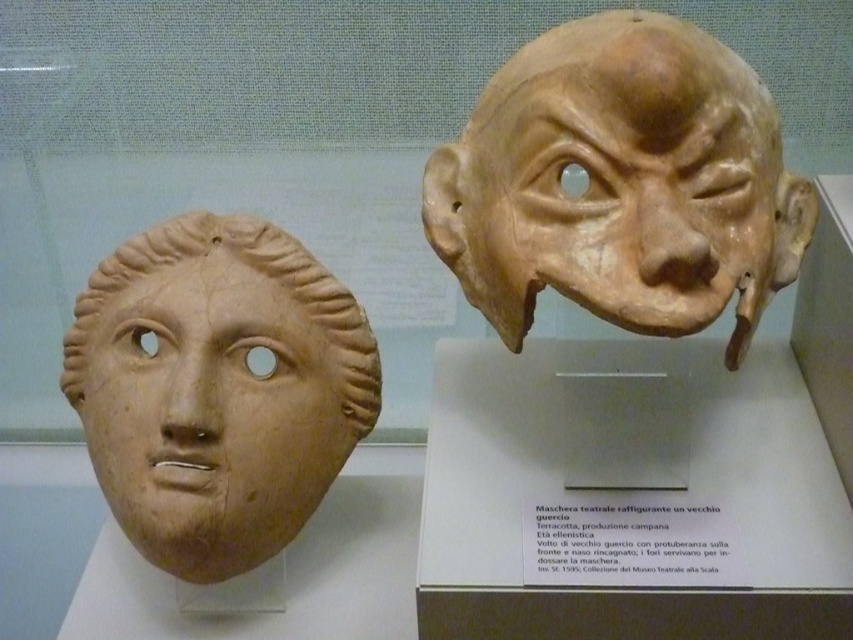
You are a museum curator arranging an exhibit. You need to ensure that visitors can see both the matte clay mask at upper right and the matte terracotta mask at left clearly. Given their positions, which mask might block the view of the other?

The matte clay mask at upper right is in front of the matte terracotta mask at left, so it might block the view of the matte terracotta mask at left.

You are an art conservator examining two points on the masks in the museum. Point A is at coordinates point (650, 221) and Point B is at point (183, 417). Which point is nearer to you as you stand in front of the masks?

Point A at point (650, 221) is closer to the camera than point (183, 417), so Point A is nearer to you as you stand in front of the masks.

You are a museum curator arranging an exhibition. You have two masks to display side by side. The matte clay mask at upper right and the matte terracotta mask at left. Based on their dimensions, which mask should be placed on the left side of the display to ensure proper spacing between them?

The matte clay mask at upper right might be wider than the matte terracotta mask at left, so placing the wider matte clay mask at upper right on the left side would allow sufficient space for the narrower matte terracotta mask at left on the right side of the display.